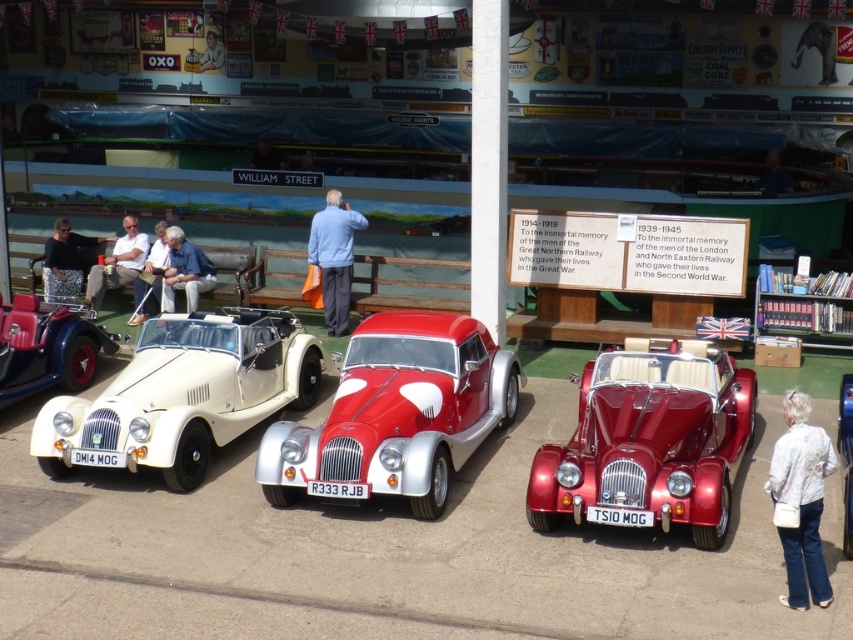
Question: Based on their relative distances, which object is farther from the white leather jacket at left?

Choices:
 (A) black floral dress at left
 (B) white leather jacket at center

Answer: (A)

Question: Can you confirm if white matte convertible at left is thinner than white leather jacket at center?

Choices:
 (A) yes
 (B) no

Answer: (B)

Question: Is matte black car at left smaller than metallic silver car at center?

Choices:
 (A) yes
 (B) no

Answer: (A)

Question: Which of the following is the farthest from the observer?

Choices:
 (A) light blue fabric jacket at center
 (B) metallic silver car at center
 (C) black floral dress at left
 (D) white leather jacket at left

Answer: (C)

Question: In this image, where is shiny red car at center located relative to black floral dress at left?

Choices:
 (A) left
 (B) right

Answer: (B)

Question: Which object is positioned farthest from the matte black car at left?

Choices:
 (A) white leather jacket at left
 (B) white leather jacket at center
 (C) white fabric jacket at lower right
 (D) light blue fabric jacket at center

Answer: (C)